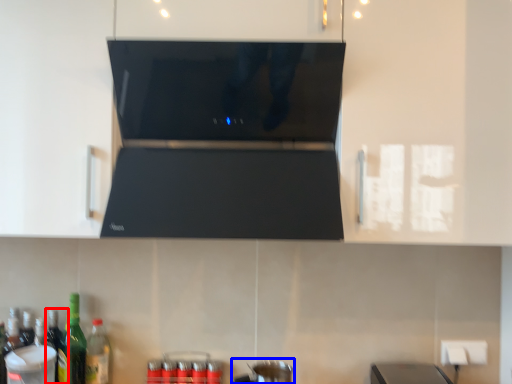
Question: Which object is further to the camera taking this photo, bottle (highlighted by a red box) or appliance (highlighted by a blue box)?

Choices:
 (A) bottle
 (B) appliance

Answer: (A)